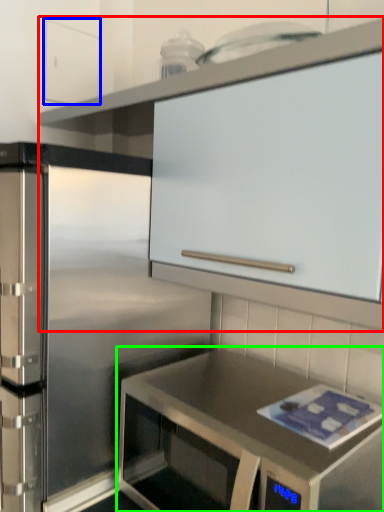
Question: Which is nearer to the cabinetry (highlighted by a red box)? cabinetry (highlighted by a blue box) or countertop (highlighted by a green box).

Choices:
 (A) cabinetry
 (B) countertop

Answer: (A)